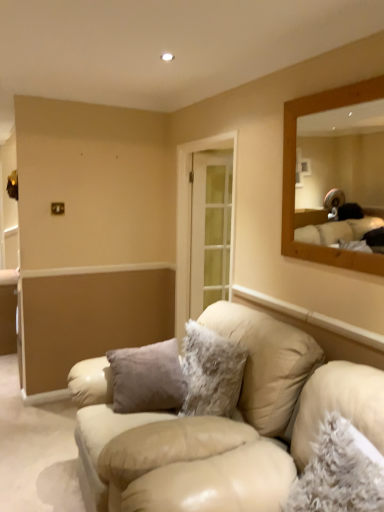
Describe the element at coordinates (222, 425) in the screenshot. Image resolution: width=384 pixels, height=512 pixels. I see `beige leather couch at center` at that location.

Locate an element on the screen. The height and width of the screenshot is (512, 384). fuzzy white pillow at center, acting as the first pillow starting from the left is located at coordinates (211, 372).

Describe the element at coordinates (340, 472) in the screenshot. I see `fuzzy gray pillow at lower right, which is the second pillow from back to front` at that location.

Find the location of `beige leather couch at center`. beige leather couch at center is located at coordinates (222, 425).

Is fuzzy white pillow at center, the second pillow positioned from the right, to the left or to the right of fuzzy gray pillow at lower right, positioned as the 1th pillow in right-to-left order, in the image?

Clearly, fuzzy white pillow at center, the second pillow positioned from the right, is on the left of fuzzy gray pillow at lower right, positioned as the 1th pillow in right-to-left order, in the image.

Is fuzzy white pillow at center, the second pillow from the front, oriented away from fuzzy gray pillow at lower right, the first pillow in the front-to-back sequence?

No, fuzzy white pillow at center, the second pillow from the front,'s orientation is not away from fuzzy gray pillow at lower right, the first pillow in the front-to-back sequence.

Is fuzzy white pillow at center, the second pillow from the front, shorter than fuzzy gray pillow at lower right, which is the second pillow from back to front?

No, fuzzy white pillow at center, the second pillow from the front, is not shorter than fuzzy gray pillow at lower right, which is the second pillow from back to front.

Is fuzzy white pillow at center, the second pillow positioned from the right, inside or outside of fuzzy gray pillow at lower right, positioned as the 1th pillow in right-to-left order?

fuzzy white pillow at center, the second pillow positioned from the right, is not inside fuzzy gray pillow at lower right, positioned as the 1th pillow in right-to-left order, it's outside.

Between beige leather couch at center and fuzzy white pillow at center, the second pillow positioned from the right, which one has more height?

With more height is beige leather couch at center.

Is beige leather couch at center positioned beyond the bounds of fuzzy white pillow at center, the second pillow positioned from the right?

Indeed, beige leather couch at center is completely outside fuzzy white pillow at center, the second pillow positioned from the right.

Consider the image. Can you tell me how much beige leather couch at center and fuzzy white pillow at center, acting as the first pillow starting from the left, differ in facing direction?

The facing directions of beige leather couch at center and fuzzy white pillow at center, acting as the first pillow starting from the left, are 2.78 degrees apart.

Is beige leather couch at center facing away from fuzzy white pillow at center, marked as the first pillow in a back-to-front arrangement?

Correct, beige leather couch at center is looking away from fuzzy white pillow at center, marked as the first pillow in a back-to-front arrangement.

Between fuzzy gray pillow at lower right, which is the second pillow from back to front, and fuzzy white pillow at center, acting as the first pillow starting from the left, which one is positioned in front?

fuzzy gray pillow at lower right, which is the second pillow from back to front, is closer to the camera.

Choose the correct answer: Is fuzzy gray pillow at lower right, positioned as the 1th pillow in right-to-left order, inside fuzzy white pillow at center, the second pillow from the front, or outside it?

fuzzy gray pillow at lower right, positioned as the 1th pillow in right-to-left order, is located beyond the bounds of fuzzy white pillow at center, the second pillow from the front.

Considering the positions of objects fuzzy gray pillow at lower right, which is the second pillow from back to front, and fuzzy white pillow at center, the second pillow from the front, in the image provided, who is more to the right, fuzzy gray pillow at lower right, which is the second pillow from back to front, or fuzzy white pillow at center, the second pillow from the front,?

fuzzy gray pillow at lower right, which is the second pillow from back to front, is more to the right.

Considering the points (322, 492) and (238, 351), which point is behind, point (322, 492) or point (238, 351)?

The point (238, 351) is farther.

Is point (248, 418) positioned before point (346, 476)?

No, it is behind (346, 476).

From the image's perspective, which one is positioned higher, beige leather couch at center or fuzzy gray pillow at lower right, which is counted as the 2th pillow, starting from the left?

fuzzy gray pillow at lower right, which is counted as the 2th pillow, starting from the left, is shown above in the image.

Which object is further away from the camera taking this photo, fuzzy white pillow at center, the second pillow from the front, or beige leather couch at center?

fuzzy white pillow at center, the second pillow from the front, is further away from the camera.

Based on the photo, looking at their sizes, would you say fuzzy white pillow at center, acting as the first pillow starting from the left, is wider or thinner than beige leather couch at center?

fuzzy white pillow at center, acting as the first pillow starting from the left, is thinner than beige leather couch at center.

Which is in front, point (197, 384) or point (214, 431)?

Positioned in front is point (214, 431).

Can you confirm if fuzzy gray pillow at lower right, which is counted as the 2th pillow, starting from the left, is wider than beige leather couch at center?

No.

Is fuzzy gray pillow at lower right, which is counted as the 2th pillow, starting from the left, facing away from beige leather couch at center?

No, fuzzy gray pillow at lower right, which is counted as the 2th pillow, starting from the left,'s orientation is not away from beige leather couch at center.

From the image's perspective, who appears lower, fuzzy gray pillow at lower right, the first pillow in the front-to-back sequence, or beige leather couch at center?

beige leather couch at center, from the image's perspective.

Is fuzzy gray pillow at lower right, which is the second pillow from back to front, taller or shorter than beige leather couch at center?

Considering their sizes, fuzzy gray pillow at lower right, which is the second pillow from back to front, has less height than beige leather couch at center.

Locate an element on the screen. pillow located above the fuzzy white pillow at center, acting as the first pillow starting from the left (from a real-world perspective) is located at coordinates (340, 472).

Image resolution: width=384 pixels, height=512 pixels. Find the location of `studio couch that appears below the fuzzy white pillow at center, the second pillow from the front (from the image's perspective)`. studio couch that appears below the fuzzy white pillow at center, the second pillow from the front (from the image's perspective) is located at coordinates (222, 425).

Looking at the image, which one is located further to fuzzy white pillow at center, marked as the first pillow in a back-to-front arrangement, fuzzy gray pillow at lower right, the first pillow in the front-to-back sequence, or beige leather couch at center?

fuzzy gray pillow at lower right, the first pillow in the front-to-back sequence.

Based on their spatial positions, is fuzzy gray pillow at lower right, which is the second pillow from back to front, or fuzzy white pillow at center, acting as the first pillow starting from the left, further from beige leather couch at center?

fuzzy gray pillow at lower right, which is the second pillow from back to front, is positioned further to the anchor beige leather couch at center.

Estimate the real-world distances between objects in this image. Which object is further from fuzzy gray pillow at lower right, the first pillow in the front-to-back sequence, fuzzy white pillow at center, the second pillow from the front, or beige leather couch at center?

fuzzy white pillow at center, the second pillow from the front, is positioned further to the anchor fuzzy gray pillow at lower right, the first pillow in the front-to-back sequence.

Which object lies nearer to the anchor point fuzzy gray pillow at lower right, the first pillow in the front-to-back sequence, beige leather couch at center or fuzzy white pillow at center, the second pillow positioned from the right?

beige leather couch at center is closer to fuzzy gray pillow at lower right, the first pillow in the front-to-back sequence.

From the image, which object appears to be nearer to fuzzy white pillow at center, the second pillow positioned from the right, beige leather couch at center or fuzzy gray pillow at lower right, which is the second pillow from back to front?

beige leather couch at center.

Which object lies further to the anchor point beige leather couch at center, fuzzy white pillow at center, the second pillow from the front, or fuzzy gray pillow at lower right, which is counted as the 2th pillow, starting from the left?

Among the two, fuzzy gray pillow at lower right, which is counted as the 2th pillow, starting from the left, is located further to beige leather couch at center.

You are a GUI agent. You are given a task and a screenshot of the screen. Output one action in this format:
    pyautogui.click(x=<x>, y=<y>)
    Task: Click on the studio couch positioned between fuzzy gray pillow at lower right, which is the second pillow from back to front, and fuzzy white pillow at center, the second pillow positioned from the right, from near to far
    
    Given the screenshot: What is the action you would take?
    pyautogui.click(x=222, y=425)